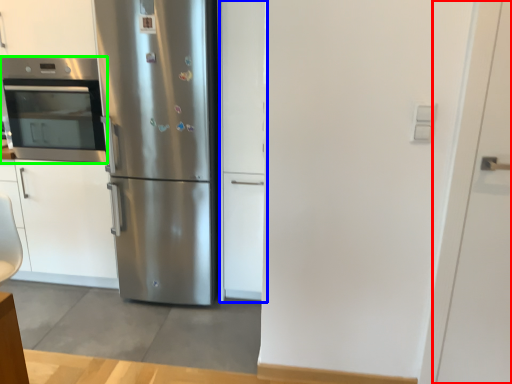
Question: Estimate the real-world distances between objects in this image. Which object is farther from door (highlighted by a red box), door (highlighted by a blue box) or oven (highlighted by a green box)?

Choices:
 (A) door
 (B) oven

Answer: (B)